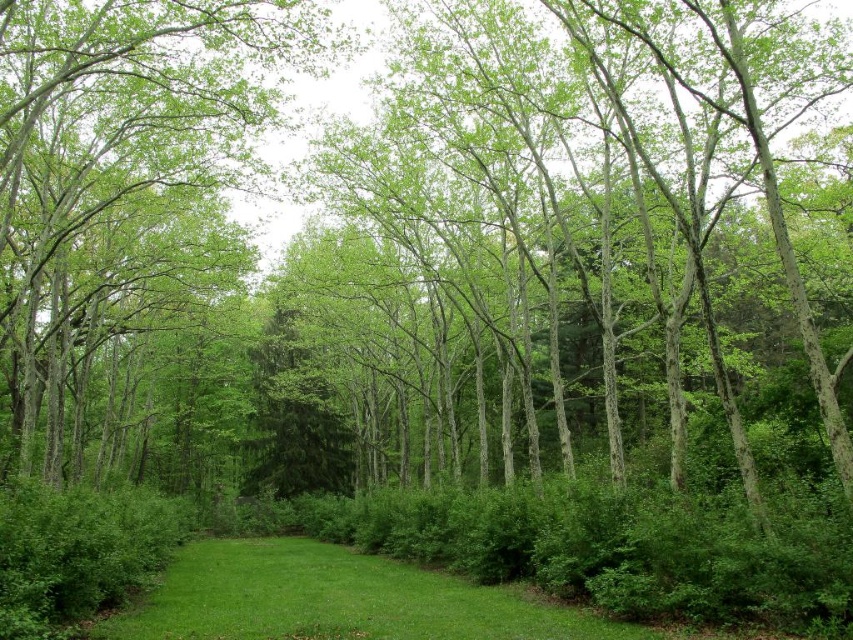
Question: Is green leafy tree at center bigger than green grass at center?

Choices:
 (A) no
 (B) yes

Answer: (B)

Question: Which point is farther to the camera?

Choices:
 (A) (13, 195)
 (B) (335, 616)

Answer: (A)

Question: Can you confirm if green leafy tree at center is positioned to the left of green grass at center?

Choices:
 (A) yes
 (B) no

Answer: (A)

Question: Can you confirm if green leafy tree at center is positioned below green grass at center?

Choices:
 (A) no
 (B) yes

Answer: (A)